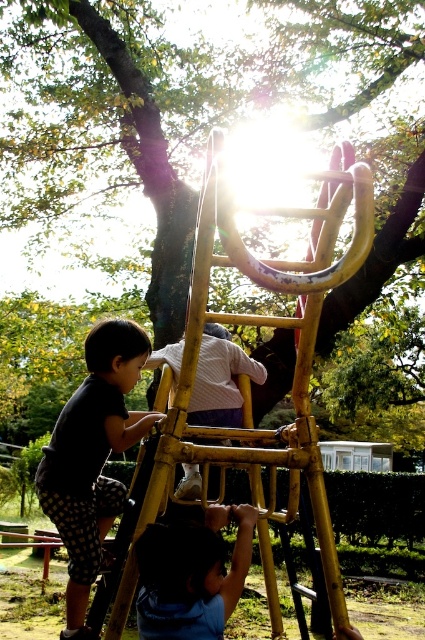
You are a parent supervising children at the playground. You notice the green leafy tree at upper center and the blue fabric pants at lower center. Which object is closer to you?

The green leafy tree at upper center is closer to you because it is further to the viewer than the blue fabric pants at lower center.

You are standing at the playground and want to take a photo of the green leafy tree at upper center. If your camera can focus on objects up to 5 meters away, will you need to move closer or farther away to capture a clear photo?

The green leafy tree at upper center is 5.69 meters away from you. Since your camera can focus up to 5 meters, you need to move closer to the green leafy tree at upper center to ensure it is within the camera range.